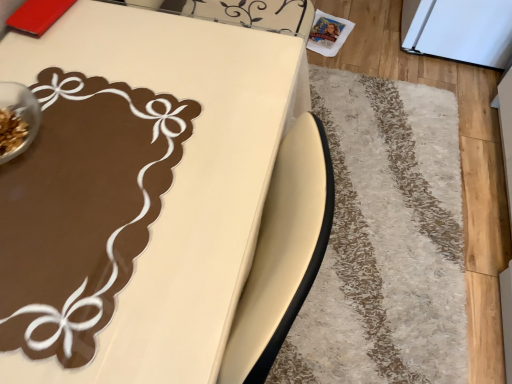
Question: Is matte brown table at upper left wider or thinner than white shaggy rug at lower right?

Choices:
 (A) wide
 (B) thin

Answer: (B)

Question: Is point [x=31, y=326] positioned closer to the camera than point [x=401, y=226]?

Choices:
 (A) closer
 (B) farther

Answer: (A)

Question: Considering their positions, is matte brown table at upper left located in front of or behind white shaggy rug at lower right?

Choices:
 (A) front
 (B) behind

Answer: (A)

Question: In terms of height, does white shaggy rug at lower right look taller or shorter compared to matte brown table at upper left?

Choices:
 (A) tall
 (B) short

Answer: (B)

Question: Is white shaggy rug at lower right wider or thinner than matte brown table at upper left?

Choices:
 (A) wide
 (B) thin

Answer: (A)

Question: In the image, is white shaggy rug at lower right positioned in front of or behind matte brown table at upper left?

Choices:
 (A) front
 (B) behind

Answer: (B)

Question: From the image's perspective, is white shaggy rug at lower right above or below matte brown table at upper left?

Choices:
 (A) below
 (B) above

Answer: (B)